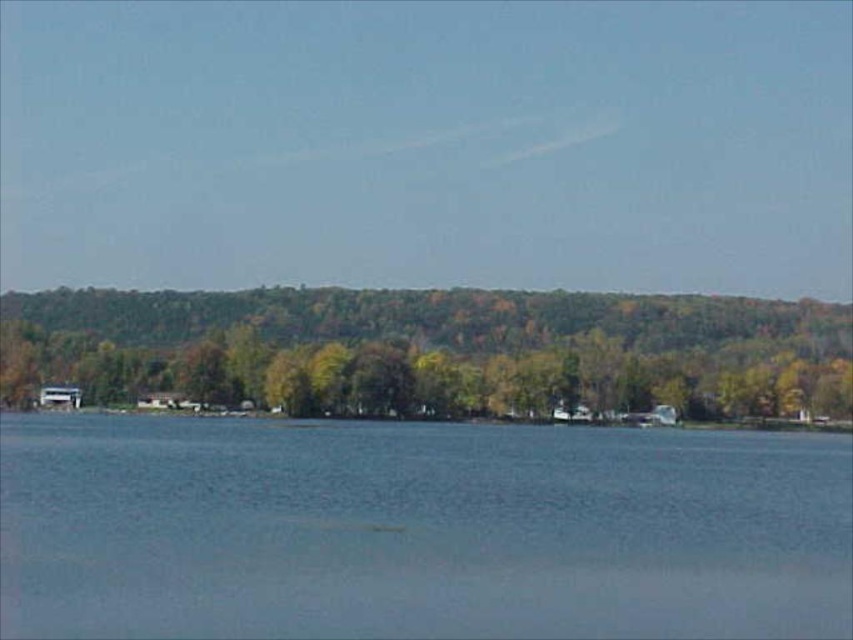
Question: Which of the following is the closest to the observer?

Choices:
 (A) (422, 332)
 (B) (70, 580)

Answer: (B)

Question: Which object is farther from the camera taking this photo?

Choices:
 (A) blue water at center
 (B) green leafy trees at center

Answer: (B)

Question: Is blue water at center positioned at the back of green leafy trees at center?

Choices:
 (A) no
 (B) yes

Answer: (A)

Question: Which object is farther from the camera taking this photo?

Choices:
 (A) green leafy trees at center
 (B) blue water at center

Answer: (A)

Question: In this image, where is blue water at center located relative to green leafy trees at center?

Choices:
 (A) below
 (B) above

Answer: (A)

Question: Is blue water at center above green leafy trees at center?

Choices:
 (A) yes
 (B) no

Answer: (B)